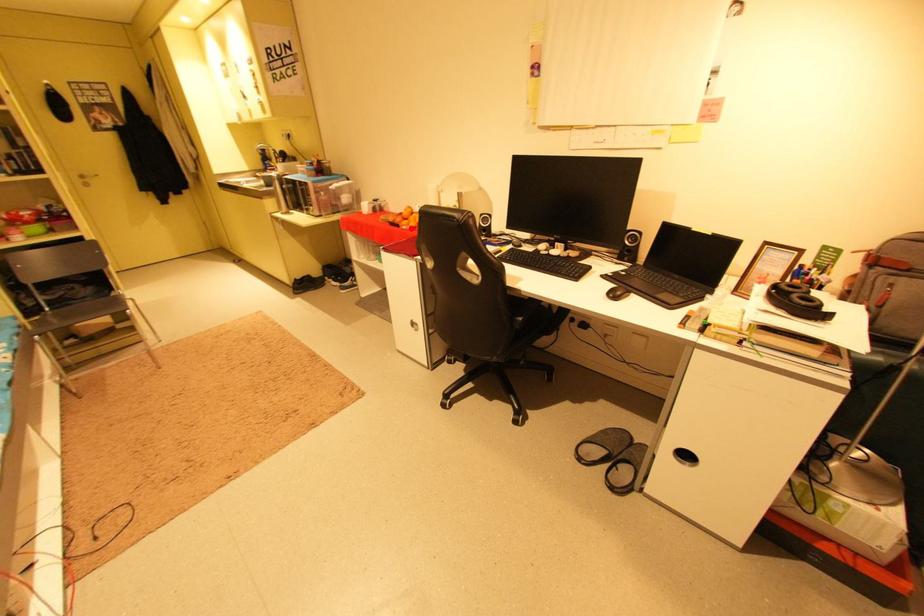
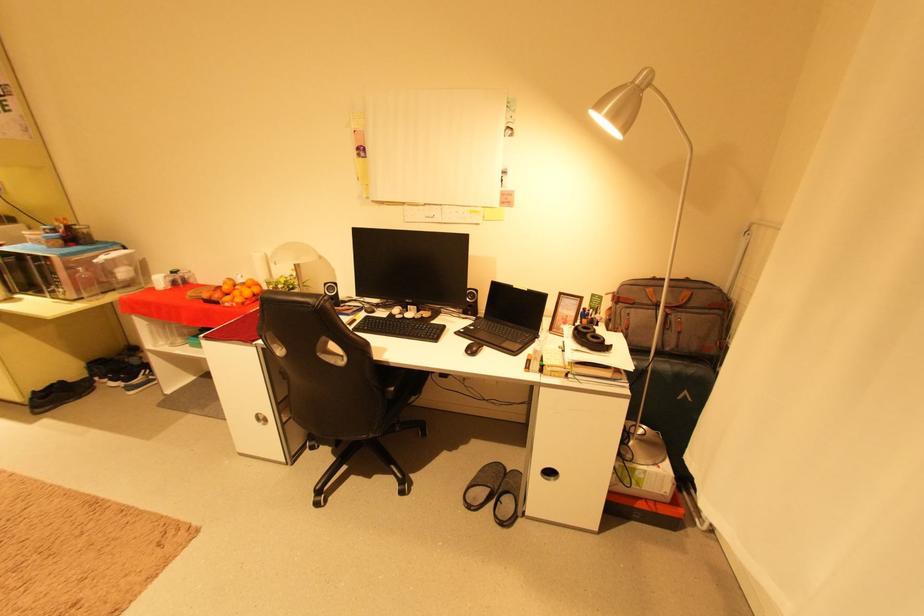
Locate, in the second image, the point that corresponds to the highlighted location in the first image.

(235, 305)